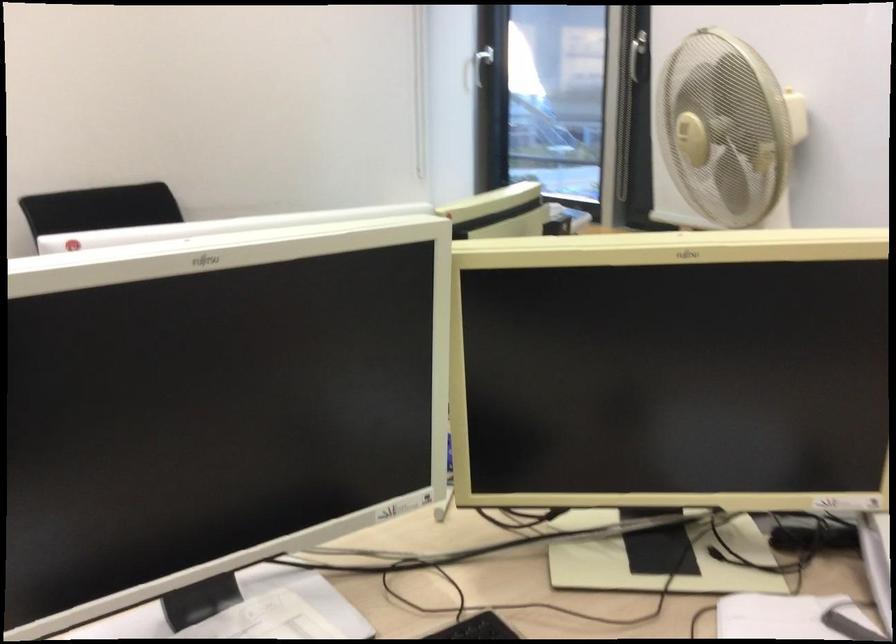
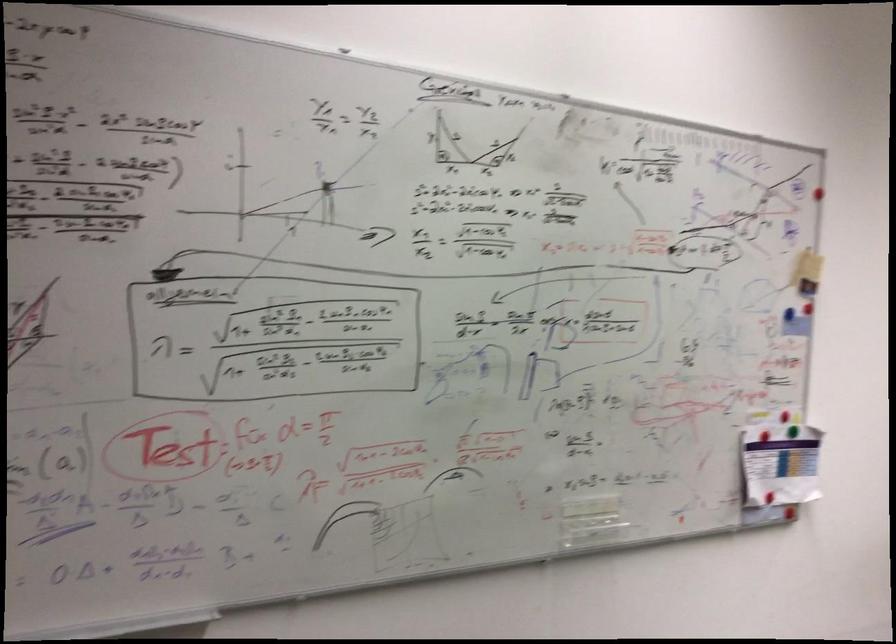
Question: What movement of the cameraman would produce the second image?

Choices:
 (A) Left
 (B) Right
 (C) Forward
 (D) Backward

Answer: (A)